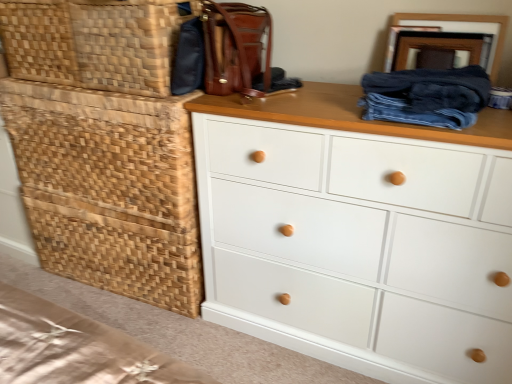
Question: Is woven wood basket at left, which ranks as the 1th basket in bottom-to-top order, far away from white painted wood chest of drawers at center?

Choices:
 (A) no
 (B) yes

Answer: (A)

Question: From a real-world perspective, does woven wood basket at left, which ranks as the 1th basket in bottom-to-top order, sit lower than white painted wood chest of drawers at center?

Choices:
 (A) yes
 (B) no

Answer: (A)

Question: Is woven wood basket at left, which is the second basket in top-to-bottom order, with white painted wood chest of drawers at center?

Choices:
 (A) yes
 (B) no

Answer: (B)

Question: Does woven wood basket at left, which is the second basket in top-to-bottom order, lie behind white painted wood chest of drawers at center?

Choices:
 (A) yes
 (B) no

Answer: (A)

Question: Is white painted wood chest of drawers at center a part of woven wood basket at left, which is the second basket in top-to-bottom order?

Choices:
 (A) no
 (B) yes

Answer: (A)

Question: Is woven wood basket at left, which ranks as the 1th basket in bottom-to-top order, wider than white painted wood chest of drawers at center?

Choices:
 (A) yes
 (B) no

Answer: (B)

Question: Is woven wood basket at left facing away from woven wood basket at left, which ranks as the 1th basket in bottom-to-top order?

Choices:
 (A) yes
 (B) no

Answer: (B)

Question: From a real-world perspective, is woven wood basket at left on woven wood basket at left, which is the second basket in top-to-bottom order?

Choices:
 (A) no
 (B) yes

Answer: (B)

Question: Considering the relative positions of woven wood basket at left and woven wood basket at left, which ranks as the 1th basket in bottom-to-top order, in the image provided, is woven wood basket at left behind woven wood basket at left, which ranks as the 1th basket in bottom-to-top order,?

Choices:
 (A) no
 (B) yes

Answer: (A)

Question: From the image's perspective, is woven wood basket at left above woven wood basket at left, which is the second basket in top-to-bottom order?

Choices:
 (A) no
 (B) yes

Answer: (B)

Question: Can you confirm if woven wood basket at left is wider than woven wood basket at left, which ranks as the 1th basket in bottom-to-top order?

Choices:
 (A) yes
 (B) no

Answer: (A)

Question: Is woven wood basket at left at the left side of woven wood basket at left, which is the second basket in top-to-bottom order?

Choices:
 (A) yes
 (B) no

Answer: (B)

Question: Does woven wood basket at left have a larger size compared to white painted wood chest of drawers at center?

Choices:
 (A) yes
 (B) no

Answer: (B)